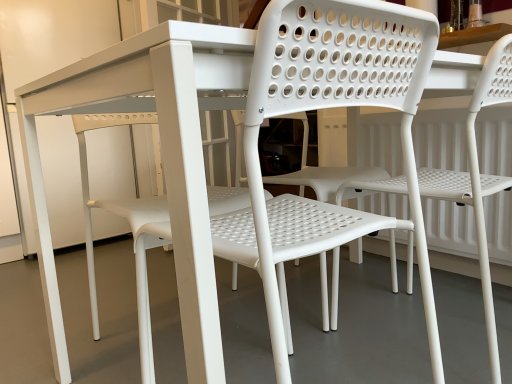
Question: Choose the correct answer: Is white plastic chair at center, the 1th chair positioned from the right, inside white plastic chair at center or outside it?

Choices:
 (A) outside
 (B) inside

Answer: (A)

Question: Is white plastic chair at center, the second chair from the left, to the left or to the right of white plastic chair at center in the image?

Choices:
 (A) left
 (B) right

Answer: (B)

Question: Which object is positioned farthest from the white plastic chair at center?

Choices:
 (A) white plastic chair at center, which is counted as the second chair, starting from the right
 (B) white plastic chair at center, the second chair from the left

Answer: (B)

Question: Which object is the closest to the white plastic chair at center, which is counted as the second chair, starting from the right?

Choices:
 (A) white plastic chair at center, the second chair from the left
 (B) white plastic chair at center

Answer: (B)